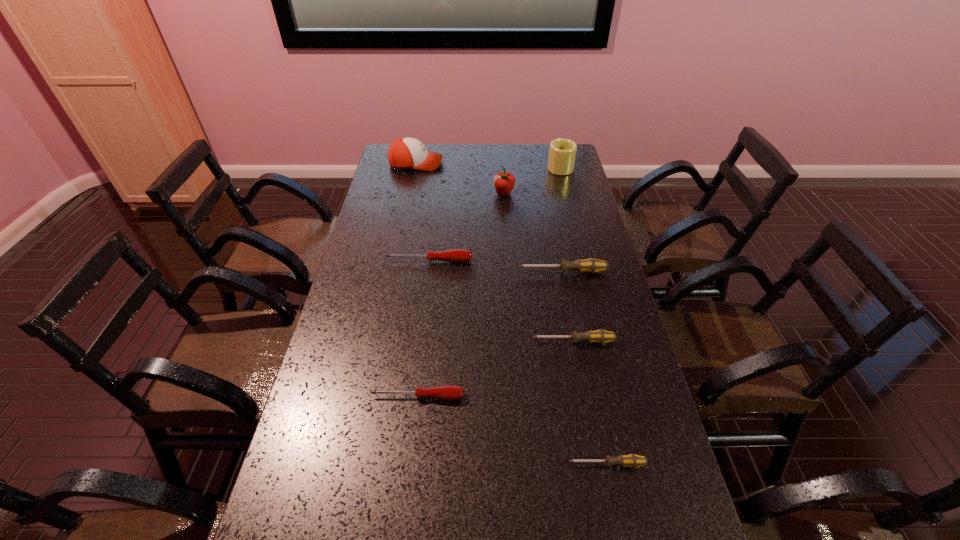
Identify the location of baseball cap present at the far edge. Image resolution: width=960 pixels, height=540 pixels. (405, 153).

The height and width of the screenshot is (540, 960). In order to click on mug situated at the far edge in this screenshot , I will do `click(562, 152)`.

What are the coordinates of `baseball cap that is positioned at the left edge` in the screenshot? It's located at (405, 153).

Where is `mug that is at the right edge`? Image resolution: width=960 pixels, height=540 pixels. mug that is at the right edge is located at coordinates (562, 152).

The height and width of the screenshot is (540, 960). In order to click on object that is at the far left corner in this screenshot , I will do `click(405, 153)`.

Locate an element on the screen. This screenshot has height=540, width=960. object that is positioned at the far right corner is located at coordinates (562, 152).

In the image, there is a desktop. Where is `blank space at the far edge`? Image resolution: width=960 pixels, height=540 pixels. blank space at the far edge is located at coordinates (502, 148).

Find the location of `vacant region at the left edge`. vacant region at the left edge is located at coordinates (317, 468).

Locate an element on the screen. This screenshot has height=540, width=960. free space at the right edge is located at coordinates (559, 217).

Locate an element on the screen. The image size is (960, 540). free spot between the third farthest screwdriver and the second nearest object is located at coordinates 495,369.